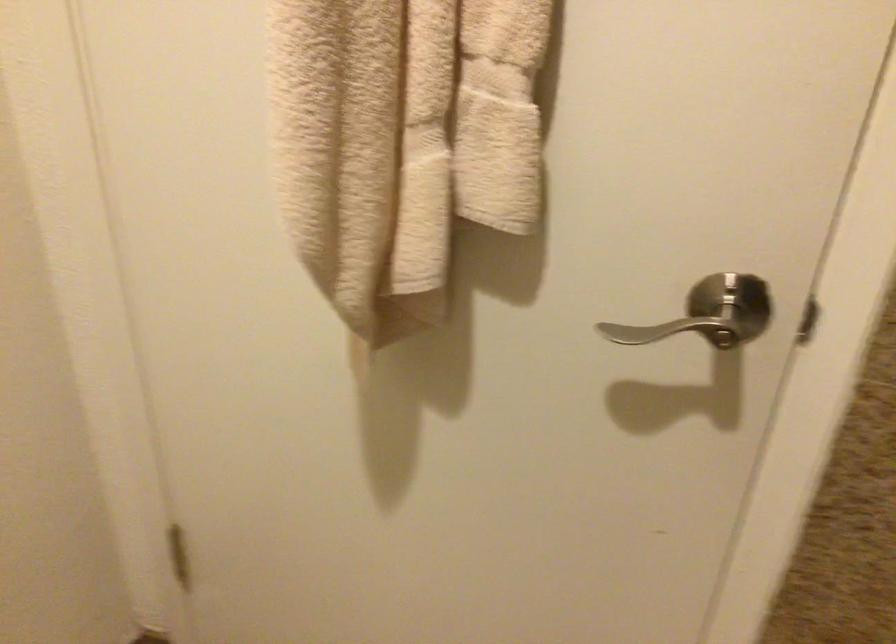
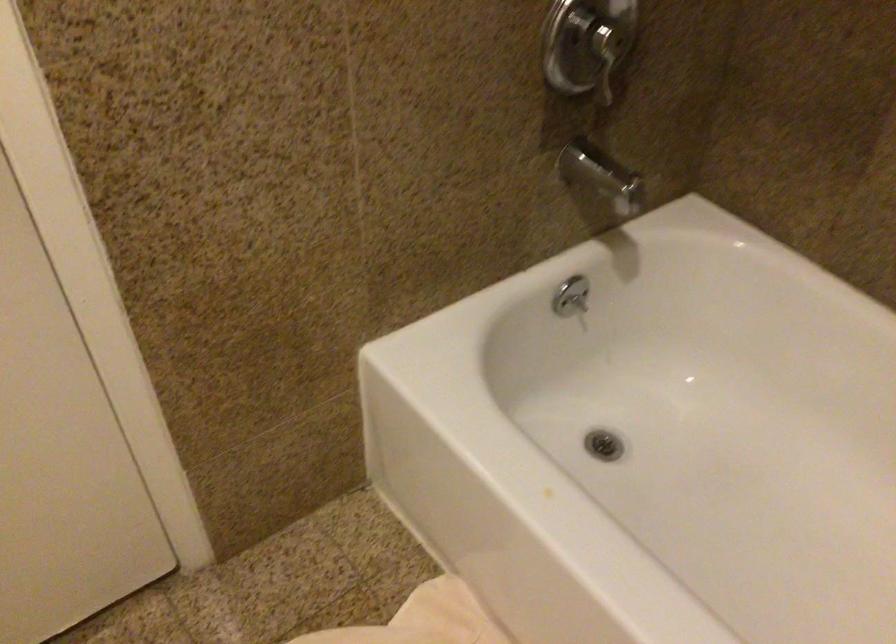
The first image is from the beginning of the video and the second image is from the end. How did the camera likely rotate when shooting the video?

The rotation direction of the camera is right-down.